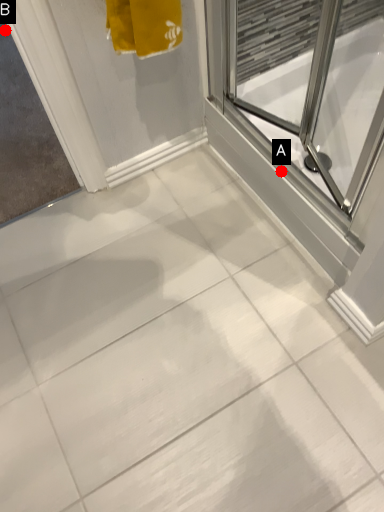
Question: Two points are circled on the image, labeled by A and B beside each circle. Among these points, which one is nearest to the camera?

Choices:
 (A) A is closer
 (B) B is closer

Answer: (A)